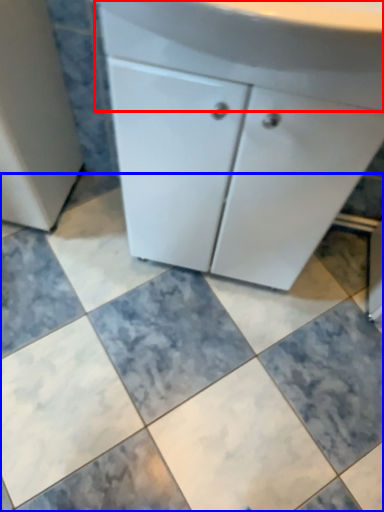
Question: Which object appears closest to the camera in this image, counter top (highlighted by a red box) or ceramic tile (highlighted by a blue box)?

Choices:
 (A) counter top
 (B) ceramic tile

Answer: (A)